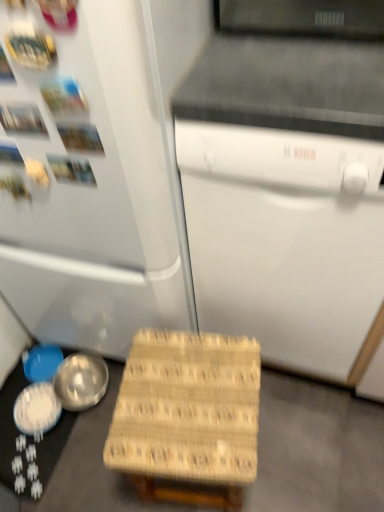
Find the location of a particular element. free location to the left of shiny silver bowl at lower left, positioned as the 2th bowl in right-to-left order is located at coordinates (10, 407).